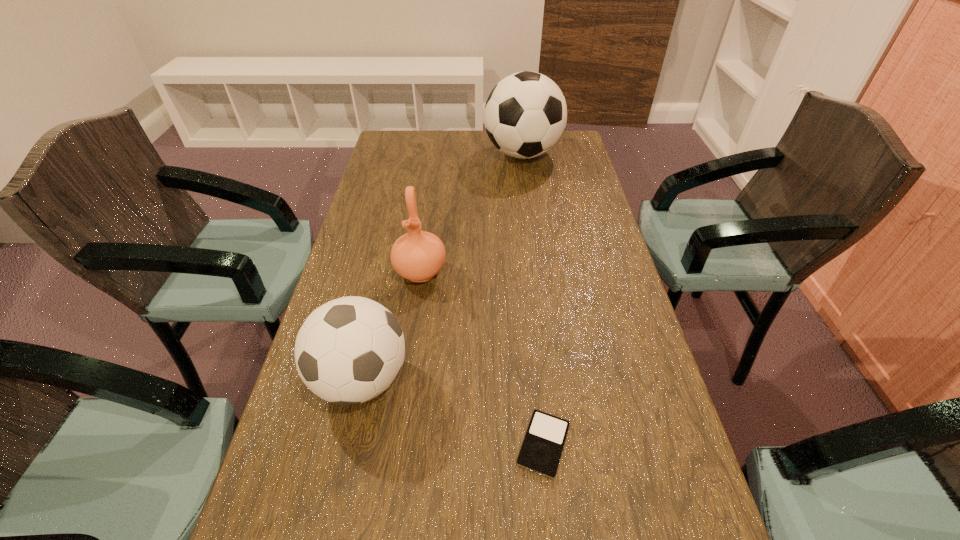
The width and height of the screenshot is (960, 540). What are the coordinates of `free spot between the iPod and the pottery` in the screenshot? It's located at (482, 358).

The height and width of the screenshot is (540, 960). In order to click on free space between the third nearest object and the farther soccer ball in this screenshot , I will do `click(471, 213)`.

Locate an element on the screen. The height and width of the screenshot is (540, 960). free area in between the taller soccer ball and the third nearest object is located at coordinates (471, 213).

At what (x,y) coordinates should I click in order to perform the action: click on vacant area that lies between the pottery and the farthest object. Please return your answer as a coordinate pair (x, y). Looking at the image, I should click on (471, 213).

Find the location of `blank region between the iPod and the farther soccer ball`. blank region between the iPod and the farther soccer ball is located at coordinates (533, 299).

You are a GUI agent. You are given a task and a screenshot of the screen. Output one action in this format:
    pyautogui.click(x=<x>, y=<y>)
    Task: Click on the object that ranks as the second closest to the shortest object
    Image resolution: width=960 pixels, height=540 pixels.
    Given the screenshot: What is the action you would take?
    pyautogui.click(x=418, y=256)

Choose which object is the nearest neighbor to the pottery. Please provide its 2D coordinates. Your answer should be formatted as a tuple, i.e. [(x, y)], where the tuple contains the x and y coordinates of a point satisfying the conditions above.

[(348, 351)]